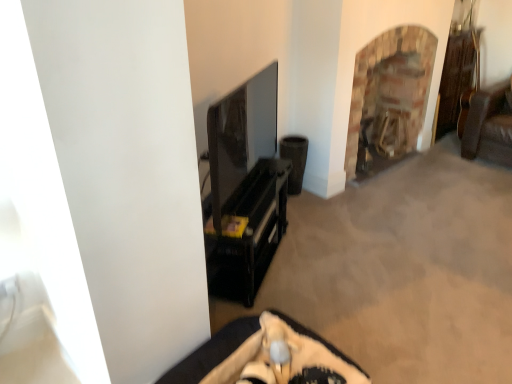
Measure the distance between point (x=302, y=382) and camera.

The distance of point (x=302, y=382) from camera is 1.57 meters.

Where is `beige fabric cushion at lower center, the 2th furniture when ordered from back to front`? The image size is (512, 384). beige fabric cushion at lower center, the 2th furniture when ordered from back to front is located at coordinates (266, 356).

At what (x,y) coordinates should I click in order to perform the action: click on black glossy tv stand at center, the 2th furniture from the bottom. Please return your answer as a coordinate pair (x, y). Looking at the image, I should click on (247, 232).

How many degrees apart are the facing directions of brick fireplace at upper right and black glossy tv stand at center, the first furniture viewed from the back?

They differ by 31.4 degrees in their facing directions.

Which is more to the left, brick fireplace at upper right or black glossy tv stand at center, placed as the 2th furniture when sorted from front to back?

black glossy tv stand at center, placed as the 2th furniture when sorted from front to back, is more to the left.

Between brick fireplace at upper right and black glossy tv stand at center, the first furniture viewed from the back, which one has larger size?

brick fireplace at upper right.

Does brick fireplace at upper right lie behind black glossy tv stand at center, the first furniture viewed from the back?

Yes, it is.

From the image's perspective, would you say black glossy tv stand at center, the first furniture viewed from the back, is shown under brown woven speaker at center-right?

Correct, black glossy tv stand at center, the first furniture viewed from the back, appears lower than brown woven speaker at center-right in the image.

How many degrees apart are the facing directions of black glossy tv stand at center, placed as the 2th furniture when sorted from front to back, and brown woven speaker at center-right?

They differ by 31.4 degrees in their facing directions.

Does point (221, 277) appear closer or farther from the camera than point (284, 148)?

Clearly, point (221, 277) is closer to the camera than point (284, 148).

Locate an element on the screen. Image resolution: width=512 pixels, height=384 pixels. furniture that is the 2nd object to the left of the brown woven speaker at center-right, starting at the anchor is located at coordinates (247, 232).

Would you say beige fabric cushion at lower center, which is the first furniture from bottom to top, is to the left or to the right of brown woven speaker at center-right in the picture?

Clearly, beige fabric cushion at lower center, which is the first furniture from bottom to top, is on the left of brown woven speaker at center-right in the image.

From the image's perspective, relative to brown woven speaker at center-right, is beige fabric cushion at lower center, the 2th furniture when ordered from back to front, above or below?

From the image's perspective, beige fabric cushion at lower center, the 2th furniture when ordered from back to front, appears below brown woven speaker at center-right.

Looking at this image, between beige fabric cushion at lower center, the 2th furniture when ordered from back to front, and brown woven speaker at center-right, which one has smaller width?

brown woven speaker at center-right is thinner.

Where is `fireplace above the beige fabric cushion at lower center, which is the first furniture from bottom to top (from the image's perspective)`? fireplace above the beige fabric cushion at lower center, which is the first furniture from bottom to top (from the image's perspective) is located at coordinates (390, 94).

Which of these two, beige fabric cushion at lower center, arranged as the 2th furniture when viewed from the top, or brick fireplace at upper right, is bigger?

brick fireplace at upper right is bigger.

Can you tell me how much beige fabric cushion at lower center, which is counted as the 1th furniture, starting from the front, and brick fireplace at upper right differ in facing direction?

The angle between the facing direction of beige fabric cushion at lower center, which is counted as the 1th furniture, starting from the front, and the facing direction of brick fireplace at upper right is 8.31 degrees.

Considering the sizes of beige fabric cushion at lower center, arranged as the 2th furniture when viewed from the top, and brick fireplace at upper right in the image, is beige fabric cushion at lower center, arranged as the 2th furniture when viewed from the top, taller or shorter than brick fireplace at upper right?

Considering their sizes, beige fabric cushion at lower center, arranged as the 2th furniture when viewed from the top, has less height than brick fireplace at upper right.

Is black glossy tv stand at center, placed as the 2th furniture when sorted from front to back, at the right side of brick fireplace at upper right?

No, black glossy tv stand at center, placed as the 2th furniture when sorted from front to back, is not to the right of brick fireplace at upper right.

Is black glossy tv stand at center, the 2th furniture from the bottom, inside or outside of brick fireplace at upper right?

black glossy tv stand at center, the 2th furniture from the bottom, exists outside the volume of brick fireplace at upper right.

How much distance is there between beige fabric cushion at lower center, arranged as the 2th furniture when viewed from the top, and black glossy tv stand at center, positioned as the 1th furniture in top-to-bottom order?

beige fabric cushion at lower center, arranged as the 2th furniture when viewed from the top, is 20.01 inches from black glossy tv stand at center, positioned as the 1th furniture in top-to-bottom order.

Does beige fabric cushion at lower center, arranged as the 2th furniture when viewed from the top, have a smaller size compared to black glossy tv stand at center, placed as the 2th furniture when sorted from front to back?

Indeed, beige fabric cushion at lower center, arranged as the 2th furniture when viewed from the top, has a smaller size compared to black glossy tv stand at center, placed as the 2th furniture when sorted from front to back.

From the picture: Which object is positioned more to the right, beige fabric cushion at lower center, arranged as the 2th furniture when viewed from the top, or black glossy tv stand at center, the first furniture viewed from the back?

beige fabric cushion at lower center, arranged as the 2th furniture when viewed from the top, is more to the right.

From the image's perspective, which one is positioned higher, beige fabric cushion at lower center, which is counted as the 1th furniture, starting from the front, or black glossy tv stand at center, the first furniture viewed from the back?

black glossy tv stand at center, the first furniture viewed from the back, from the image's perspective.

Does brick fireplace at upper right come behind beige fabric cushion at lower center, which is counted as the 1th furniture, starting from the front?

Yes, it is behind beige fabric cushion at lower center, which is counted as the 1th furniture, starting from the front.

From the image's perspective, is brick fireplace at upper right located above or below beige fabric cushion at lower center, the 2th furniture when ordered from back to front?

brick fireplace at upper right is above beige fabric cushion at lower center, the 2th furniture when ordered from back to front.

Does brick fireplace at upper right turn towards beige fabric cushion at lower center, arranged as the 2th furniture when viewed from the top?

No, brick fireplace at upper right is not turned towards beige fabric cushion at lower center, arranged as the 2th furniture when viewed from the top.

Is brick fireplace at upper right taller or shorter than beige fabric cushion at lower center, the 2th furniture when ordered from back to front?

Considering their sizes, brick fireplace at upper right has more height than beige fabric cushion at lower center, the 2th furniture when ordered from back to front.

The image size is (512, 384). I want to click on fireplace above the black glossy tv stand at center, the 2th furniture from the bottom (from the image's perspective), so click(390, 94).

The width and height of the screenshot is (512, 384). Identify the location of speaker that is under the black glossy tv stand at center, the 2th furniture from the bottom (from a real-world perspective). (295, 160).

Based on their spatial positions, is black glossy tv stand at center, the 2th furniture from the bottom, or beige fabric cushion at lower center, which is counted as the 1th furniture, starting from the front, further from brick fireplace at upper right?

beige fabric cushion at lower center, which is counted as the 1th furniture, starting from the front, lies further to brick fireplace at upper right than the other object.

In the scene shown: When comparing their distances from brick fireplace at upper right, does beige fabric cushion at lower center, the 2th furniture when ordered from back to front, or black glossy tv stand at center, the 2th furniture from the bottom, seem further?

The object further to brick fireplace at upper right is beige fabric cushion at lower center, the 2th furniture when ordered from back to front.

When comparing their distances from brick fireplace at upper right, does brown woven speaker at center-right or black glossy tv stand at center, the first furniture viewed from the back, seem closer?

Among the two, brown woven speaker at center-right is located nearer to brick fireplace at upper right.

Looking at the image, which one is located further to beige fabric cushion at lower center, the 2th furniture when ordered from back to front, black glossy tv stand at center, the 2th furniture from the bottom, or brown woven speaker at center-right?

brown woven speaker at center-right lies further to beige fabric cushion at lower center, the 2th furniture when ordered from back to front, than the other object.

Which object lies further to the anchor point brick fireplace at upper right, brown woven speaker at center-right or beige fabric cushion at lower center, which is the first furniture from bottom to top?

beige fabric cushion at lower center, which is the first furniture from bottom to top, lies further to brick fireplace at upper right than the other object.

From the picture: Estimate the real-world distances between objects in this image. Which object is further from black glossy tv stand at center, the first furniture viewed from the back, beige fabric cushion at lower center, arranged as the 2th furniture when viewed from the top, or brown woven speaker at center-right?

brown woven speaker at center-right lies further to black glossy tv stand at center, the first furniture viewed from the back, than the other object.

Estimate the real-world distances between objects in this image. Which object is closer to beige fabric cushion at lower center, the 2th furniture when ordered from back to front, brick fireplace at upper right or brown woven speaker at center-right?

The object closer to beige fabric cushion at lower center, the 2th furniture when ordered from back to front, is brown woven speaker at center-right.

In the scene shown: Considering their positions, is brick fireplace at upper right positioned further to brown woven speaker at center-right than beige fabric cushion at lower center, which is the first furniture from bottom to top?

beige fabric cushion at lower center, which is the first furniture from bottom to top, is positioned further to the anchor brown woven speaker at center-right.

You are a GUI agent. You are given a task and a screenshot of the screen. Output one action in this format:
    pyautogui.click(x=<x>, y=<y>)
    Task: Click on the furniture positioned between beige fabric cushion at lower center, the 2th furniture when ordered from back to front, and brick fireplace at upper right from near to far
    The image size is (512, 384).
    Given the screenshot: What is the action you would take?
    pyautogui.click(x=247, y=232)

Find the location of a particular element. Image resolution: width=512 pixels, height=384 pixels. fireplace between beige fabric cushion at lower center, which is the first furniture from bottom to top, and brown woven speaker at center-right from front to back is located at coordinates (390, 94).

The width and height of the screenshot is (512, 384). I want to click on fireplace between black glossy tv stand at center, placed as the 2th furniture when sorted from front to back, and brown woven speaker at center-right from front to back, so click(x=390, y=94).

The height and width of the screenshot is (384, 512). I want to click on furniture between beige fabric cushion at lower center, which is the first furniture from bottom to top, and brown woven speaker at center-right from front to back, so (x=247, y=232).